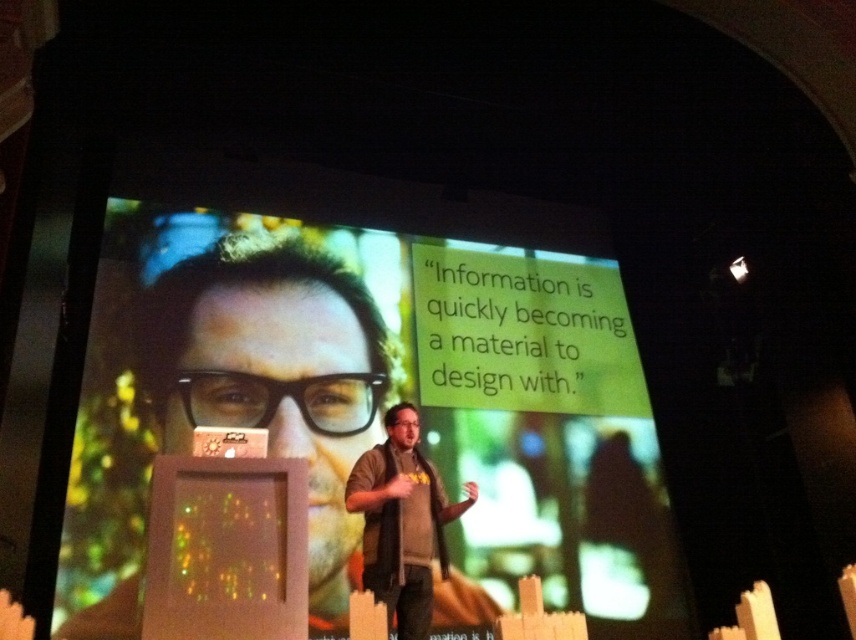
Question: Can you confirm if matte black screen at center is positioned above dark brown leather jacket at center?

Choices:
 (A) no
 (B) yes

Answer: (B)

Question: Among these points, which one is nearest to the camera?

Choices:
 (A) (550, 324)
 (B) (428, 497)

Answer: (B)

Question: Which point is closer to the camera?

Choices:
 (A) matte black screen at center
 (B) dark brown leather jacket at center

Answer: (B)

Question: Does matte black screen at center have a larger size compared to dark brown leather jacket at center?

Choices:
 (A) no
 (B) yes

Answer: (B)

Question: Is matte black screen at center positioned behind dark brown leather jacket at center?

Choices:
 (A) no
 (B) yes

Answer: (B)

Question: Which point appears farthest from the camera in this image?

Choices:
 (A) (557, 212)
 (B) (417, 627)

Answer: (A)